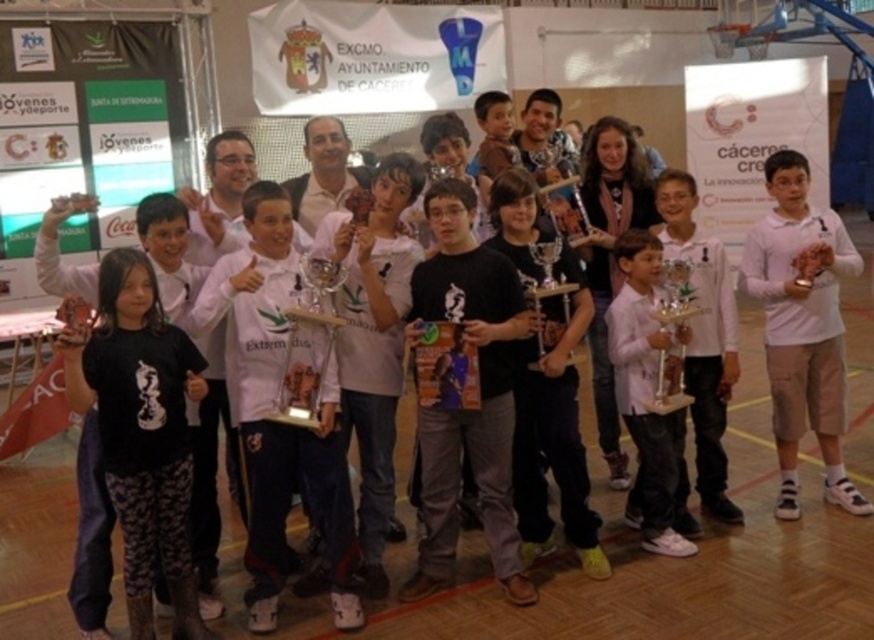
Question: Does white cotton shirt at right have a greater width compared to pink matte shirt at center?

Choices:
 (A) no
 (B) yes

Answer: (B)

Question: Which is nearer to the pink matte shirt at center?

Choices:
 (A) white cotton shirt at right
 (B) clear glass trophy at center

Answer: (A)

Question: Which object appears farthest from the camera in this image?

Choices:
 (A) black matte t-shirt at lower left
 (B) clear glass trophy at center
 (C) white cotton shirt at right

Answer: (C)

Question: Can you confirm if pink matte shirt at center is thinner than metallic silver trophy at center?

Choices:
 (A) yes
 (B) no

Answer: (B)

Question: Can you confirm if white matte shirt at center is positioned below white cotton shirt at right?

Choices:
 (A) yes
 (B) no

Answer: (A)

Question: Which object is positioned closest to the clear glass trophy at center?

Choices:
 (A) white matte shirt at center
 (B) black matte t-shirt at lower left
 (C) white cotton shirt at right
 (D) pink matte shirt at center

Answer: (A)